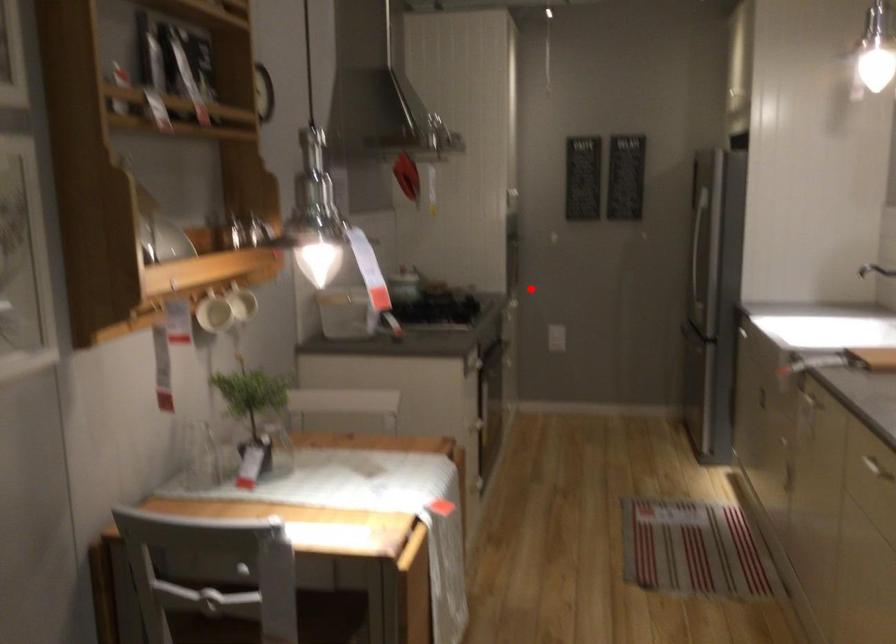
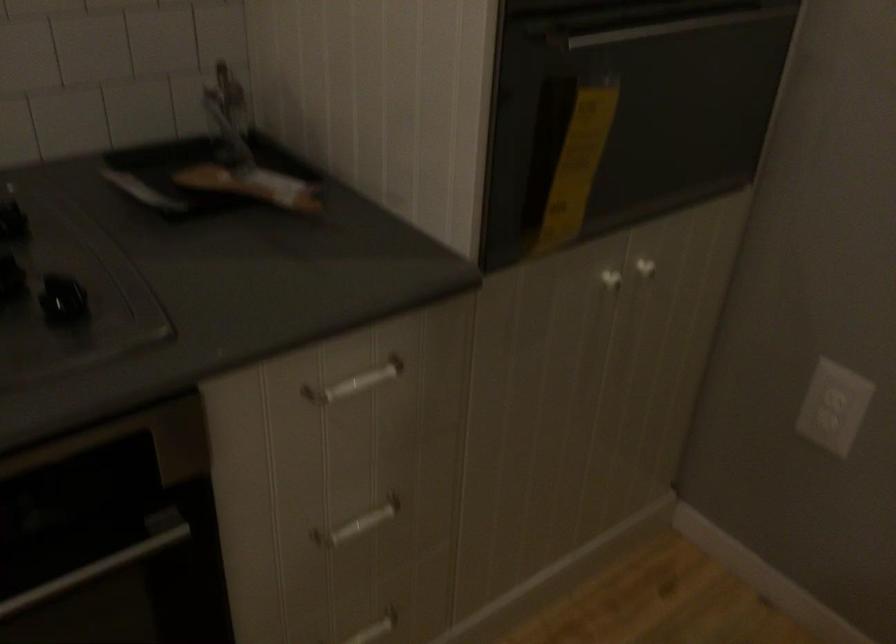
Question: I am providing you with two images of the same scene from different viewpoints. Given a red point in image1, look at the same physical point in image2. Is it:

Choices:
 (A) Closer to the viewpoint
 (B) Farther from the viewpoint

Answer: (A)